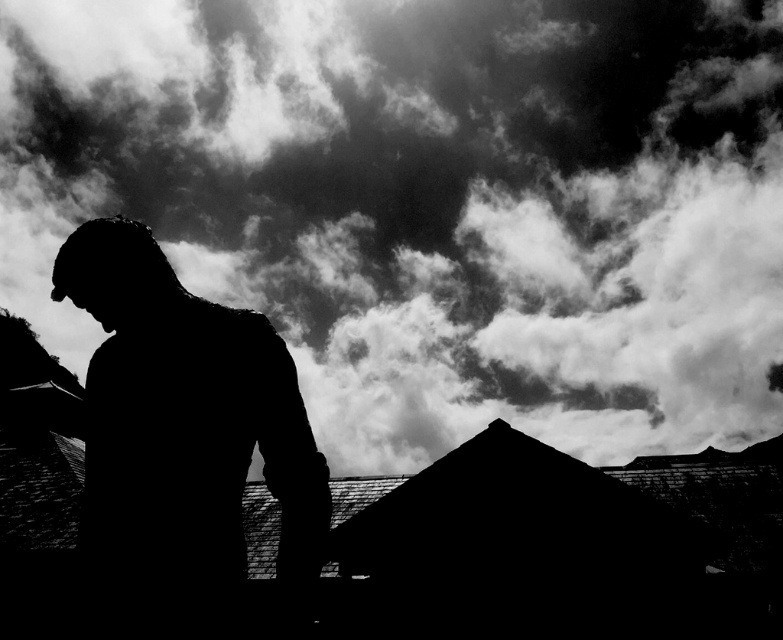
You are an architect designing a new garden and want to place a statue in a way that it aligns with the position of the cloudy sky. Based on the image, is the black matte statue at center positioned in front of or behind the cloudy sky at upper center?

The black matte statue at center is behind the cloudy sky at upper center, so it is positioned behind the sky.

In the black and white photo, there is a point marked at coordinates (430,202). What object from the scene is located at that point?

The cloudy sky at upper center is located at point (430,202).

You are an architect designing a new building. You need to ensure that the cloudy sky at upper center and the black matte statue at center are visible from the main entrance. Given their positions, which object will be seen first as someone approaches the entrance from the front?

The black matte statue at center will be seen first because it is positioned to the left of the cloudy sky at upper center, making it closer to the entrance path.